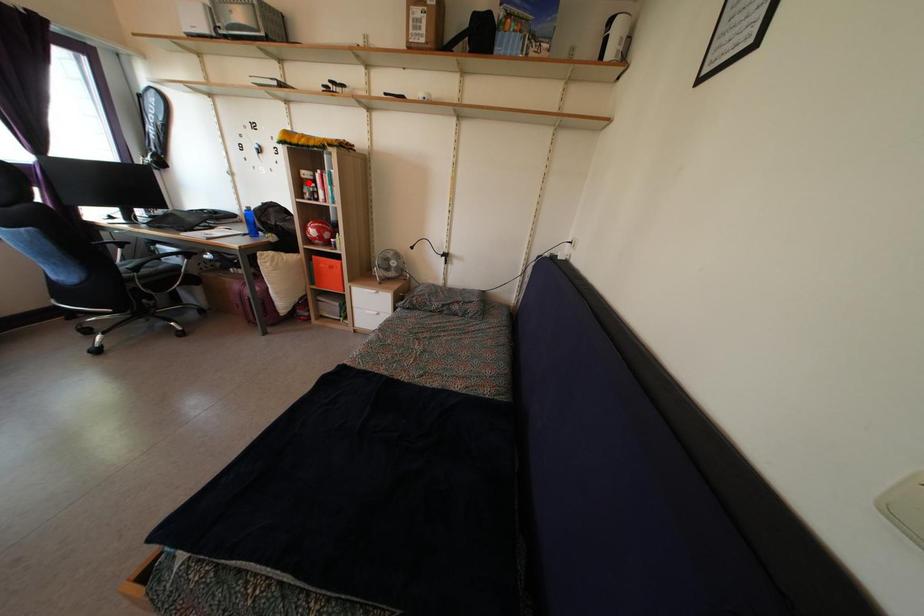
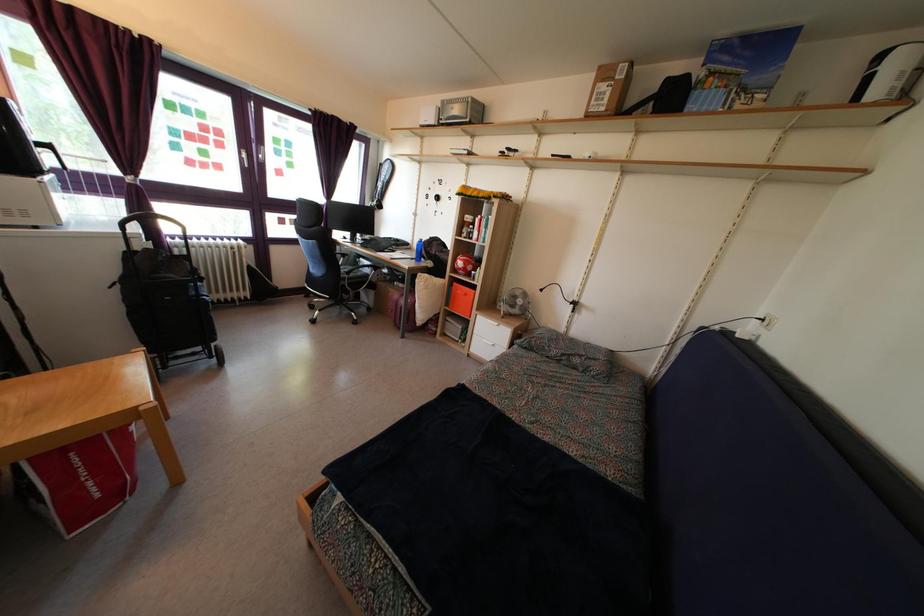
Where in the second image is the point corresponding to the highlighted location from the first image?

(470, 227)